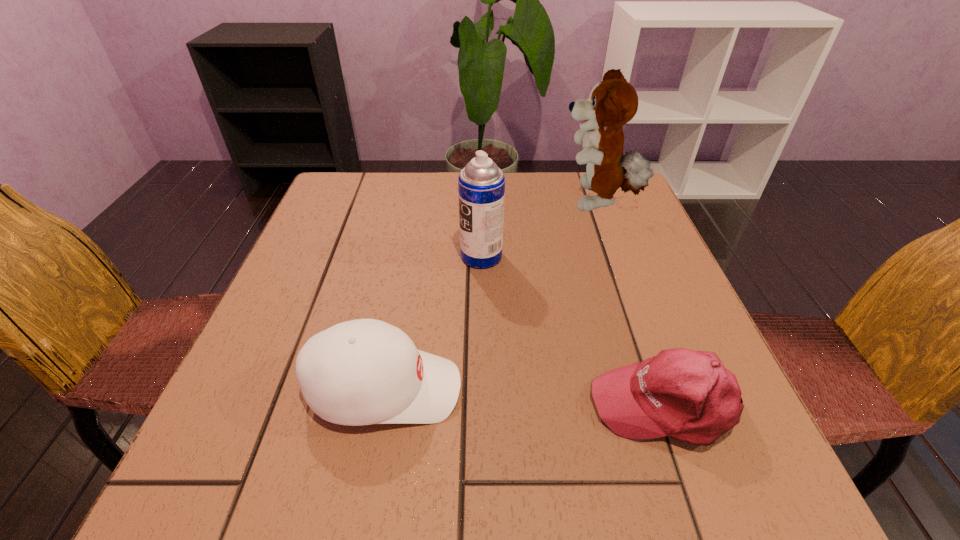
Where is `object present at the left edge`? This screenshot has height=540, width=960. object present at the left edge is located at coordinates (365, 371).

Image resolution: width=960 pixels, height=540 pixels. Find the location of `puppy that is at the right edge`. puppy that is at the right edge is located at coordinates (613, 102).

Where is `baseball cap that is positioned at the right edge`? baseball cap that is positioned at the right edge is located at coordinates 688,395.

Identify the location of object that is at the far right corner. Image resolution: width=960 pixels, height=540 pixels. (613, 102).

Where is `object located at the near right corner`? The image size is (960, 540). object located at the near right corner is located at coordinates (688, 395).

In the image, there is a desktop. Where is `vacant area at the far edge`? The image size is (960, 540). vacant area at the far edge is located at coordinates (409, 199).

Where is `blank space at the near edge of the desktop`? blank space at the near edge of the desktop is located at coordinates (353, 503).

Where is `free region at the left edge`? The image size is (960, 540). free region at the left edge is located at coordinates (326, 319).

I want to click on free space at the right edge of the desktop, so click(610, 278).

In the image, there is a desktop. What are the coordinates of `vacant space at the far left corner` in the screenshot? It's located at (348, 190).